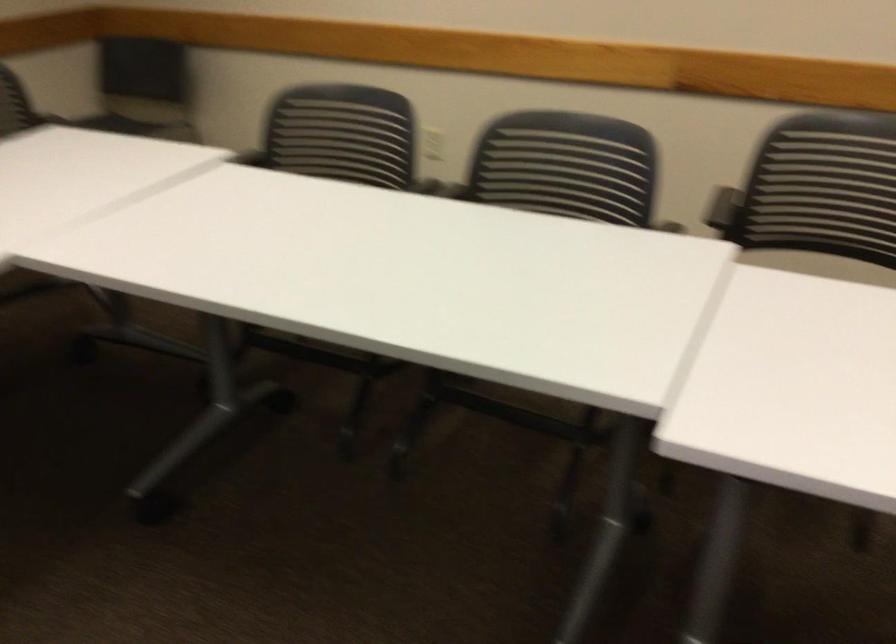
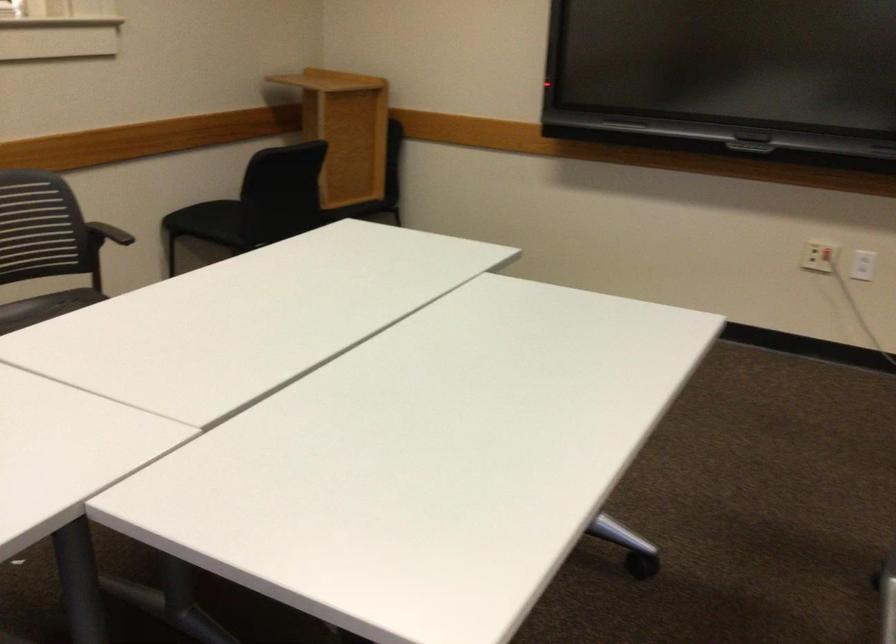
The first image is from the beginning of the video and the second image is from the end. How did the camera likely rotate when shooting the video?

The camera's rotation is toward right-down.